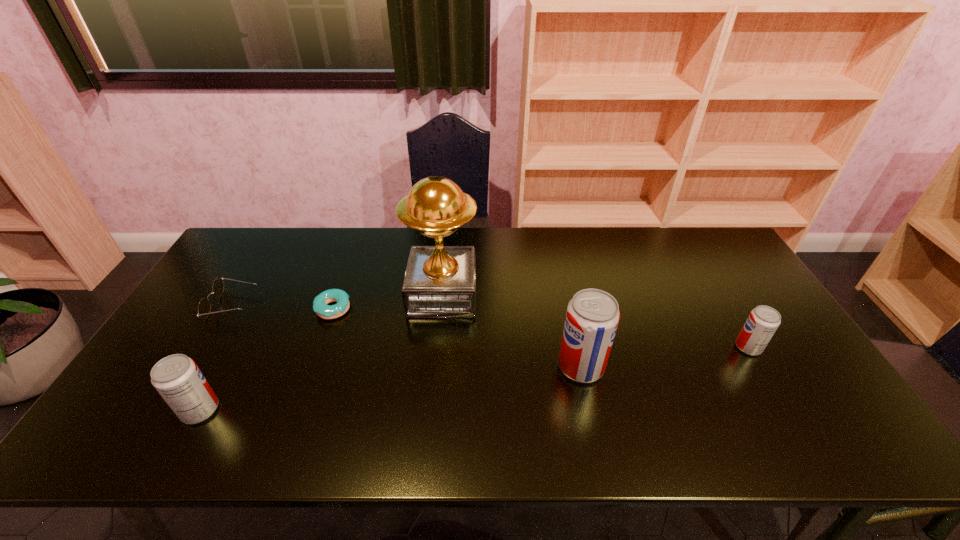
The width and height of the screenshot is (960, 540). I want to click on the leftmost soda, so click(177, 378).

Identify the location of the second tallest soda. The height and width of the screenshot is (540, 960). (177, 378).

Where is `the tallest soda`? the tallest soda is located at coordinates (592, 317).

You are a GUI agent. You are given a task and a screenshot of the screen. Output one action in this format:
    pyautogui.click(x=<x>, y=<y>)
    Task: Click on the second object from right to left
    The width and height of the screenshot is (960, 540).
    Given the screenshot: What is the action you would take?
    pyautogui.click(x=592, y=317)

Locate an element on the screen. This screenshot has width=960, height=540. the rightmost object is located at coordinates (763, 321).

Where is `the fourth tallest object`? The height and width of the screenshot is (540, 960). the fourth tallest object is located at coordinates (763, 321).

Find the location of a particular element. The width and height of the screenshot is (960, 540). doughnut is located at coordinates (320, 302).

Where is `the shortest object`? The height and width of the screenshot is (540, 960). the shortest object is located at coordinates (320, 302).

The image size is (960, 540). Identify the location of the fourth object from left to right. (440, 281).

Where is `the tallest object`? the tallest object is located at coordinates (440, 281).